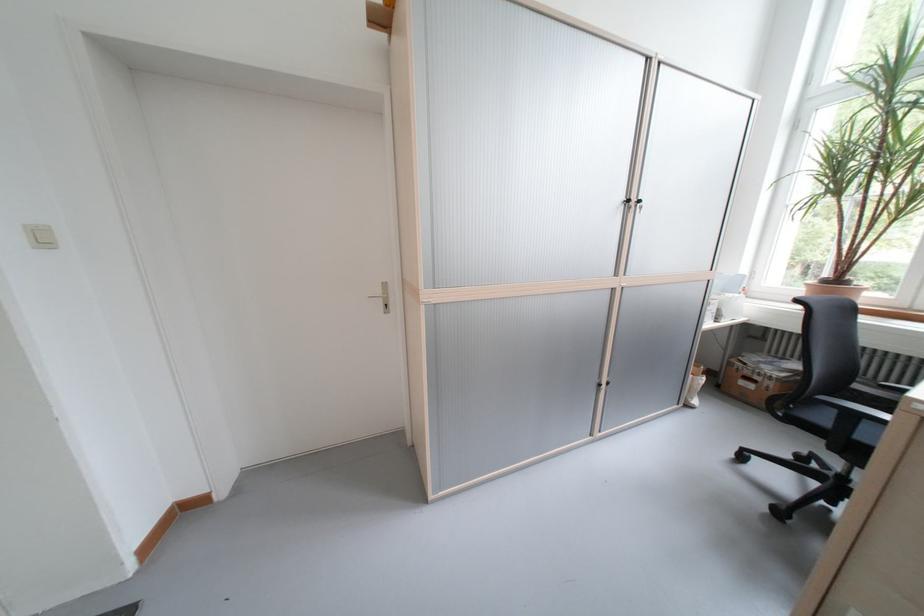
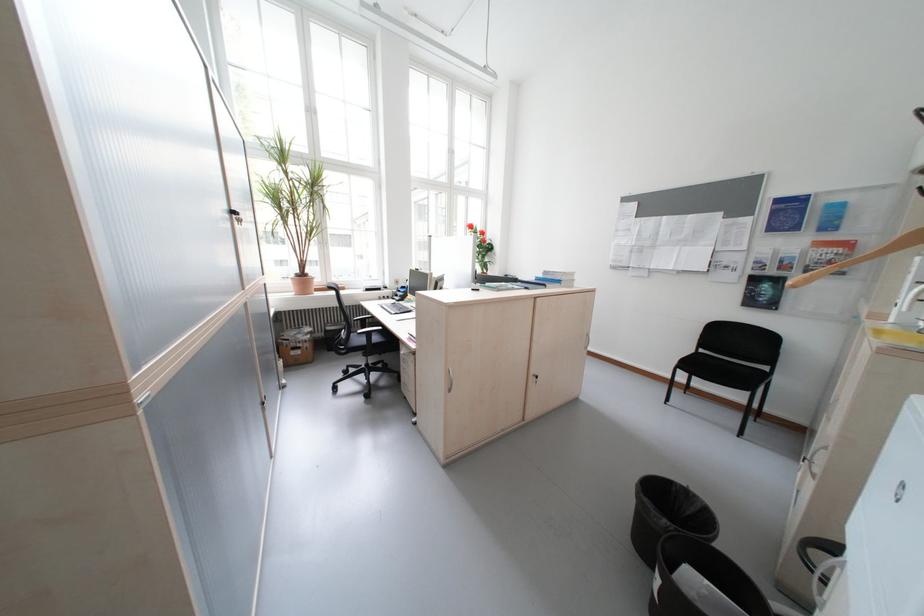
Where in the second image is the point corresponding to the point at 862,418 from the first image?

(380, 334)